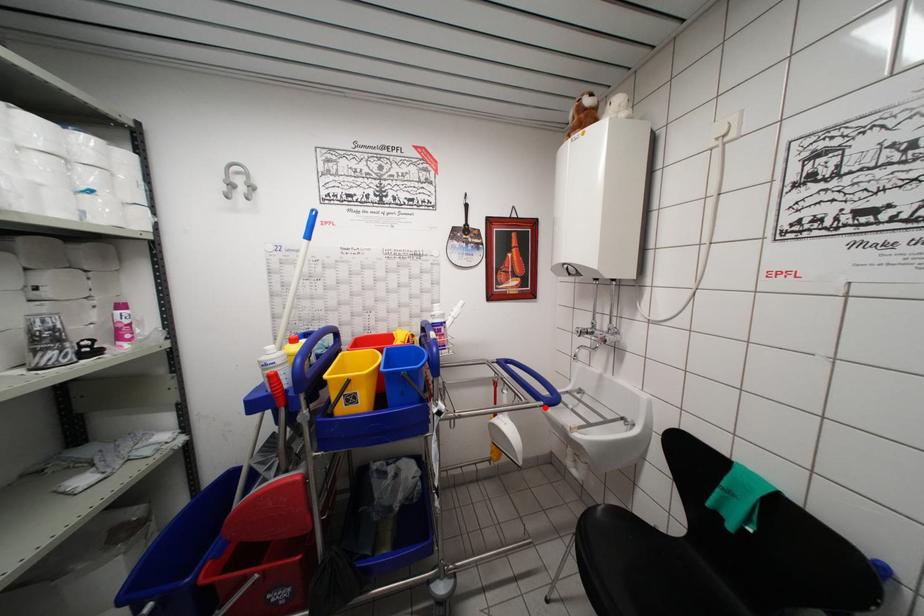
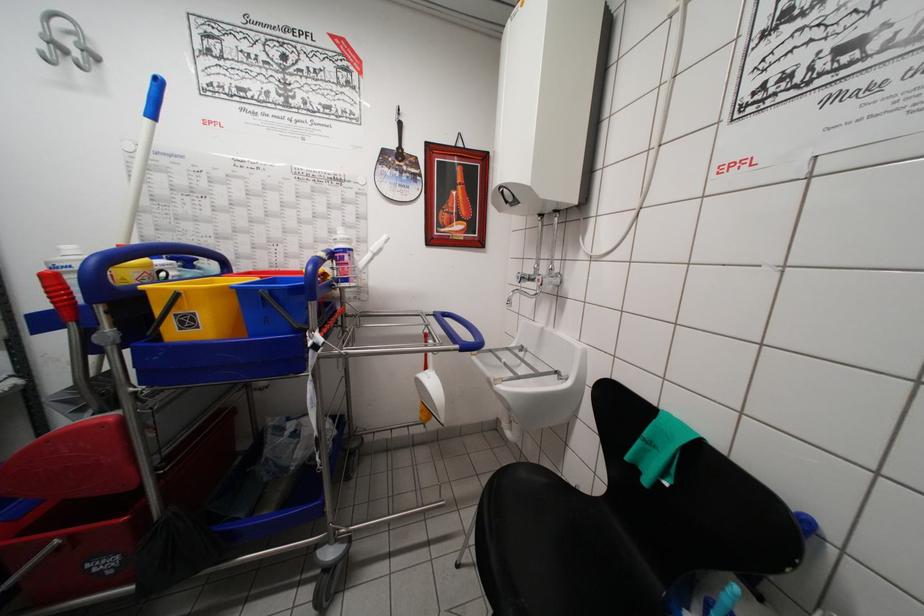
Question: I am providing you with two images of the same scene from different viewpoints. Given a red point in image1, look at the same physical point in image2. Is it:

Choices:
 (A) Closer to the viewpoint
 (B) Farther from the viewpoint

Answer: (B)